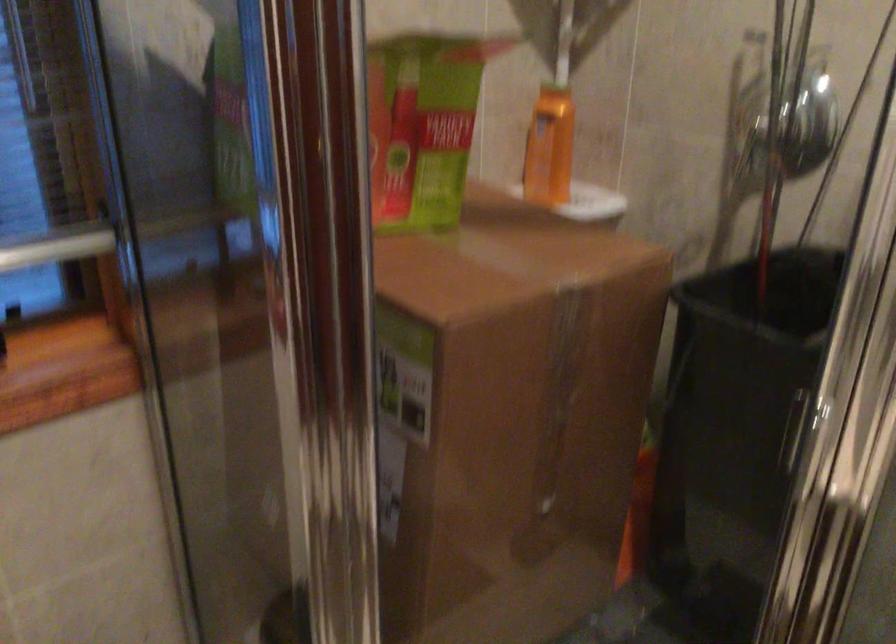
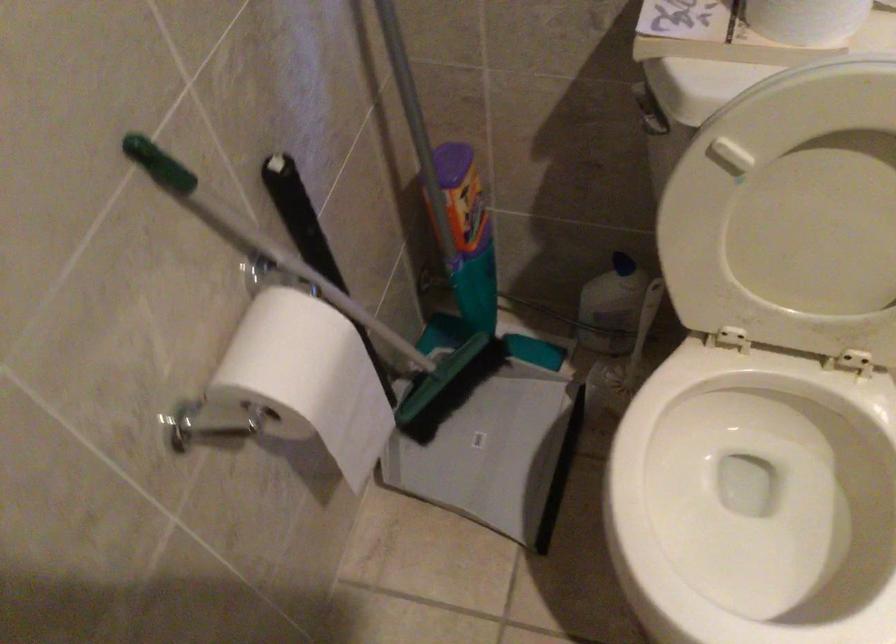
The images are taken continuously from a first-person perspective. In which direction is your viewpoint rotating?

The rotation direction of the camera is left-down.